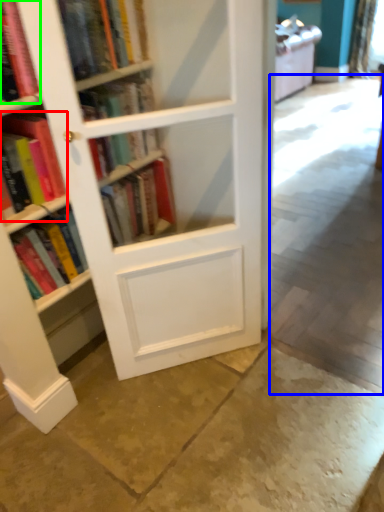
Question: Based on their relative distances, which object is nearer to book (highlighted by a red box)? Choose from concrete (highlighted by a blue box) and book (highlighted by a green box).

Choices:
 (A) concrete
 (B) book

Answer: (B)